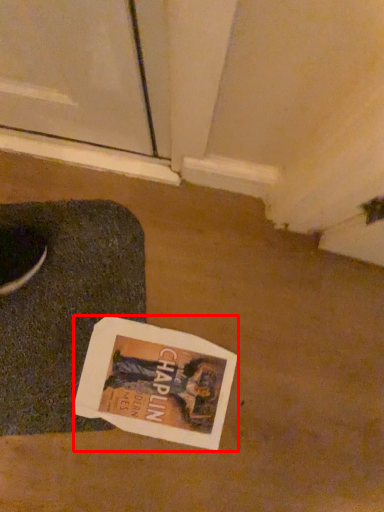
Question: In this image, where is magazine (annotated by the red box) located relative to yoga mat?

Choices:
 (A) left
 (B) right

Answer: (B)